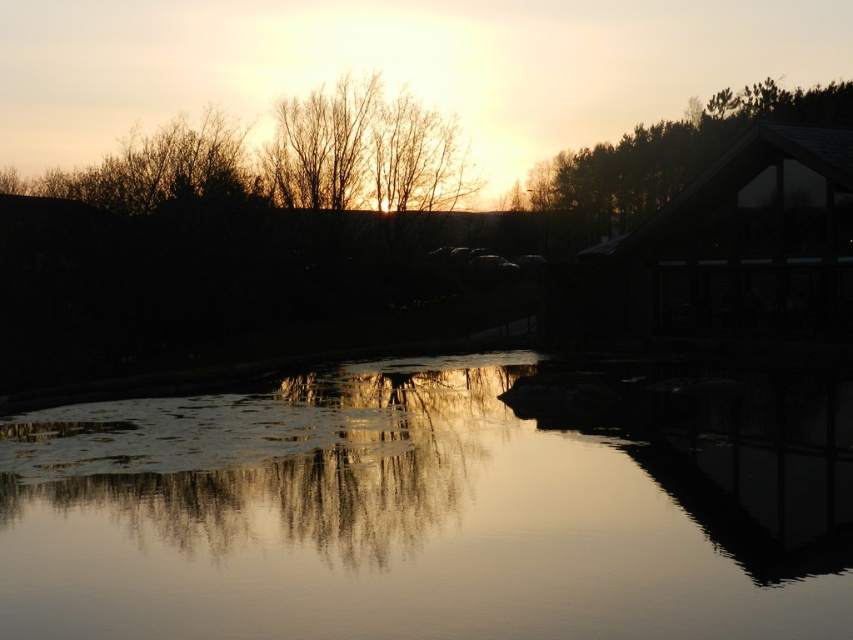
You are a drone operator who needs to fly a drone between the brown wooden hut at upper right and the green matte roof at upper right. The drone has a maximum flight distance of 40 meters. Can the drone safely fly between them without exceeding its maximum range?

The brown wooden hut at upper right and green matte roof at upper right are 44.24 meters apart from each other, which exceeds the drone maximum flight distance of 40 meters. The drone cannot safely fly between them without exceeding its maximum range.

In the scene shown: You are an architect analyzing the sunset scene. You notice the brown wooden hut at upper right and the green matte roof at upper right. Which object occupies a larger area in the image?

The green matte roof at upper right occupies a larger area in the image because the brown wooden hut at upper right has a smaller size compared to it.